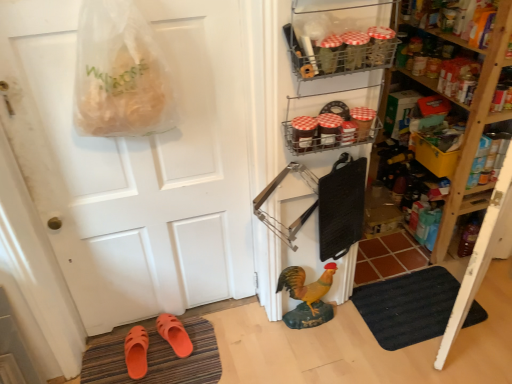
Where is `vacant space to the left of painted wood rooster at lower center`? The width and height of the screenshot is (512, 384). vacant space to the left of painted wood rooster at lower center is located at coordinates (260, 331).